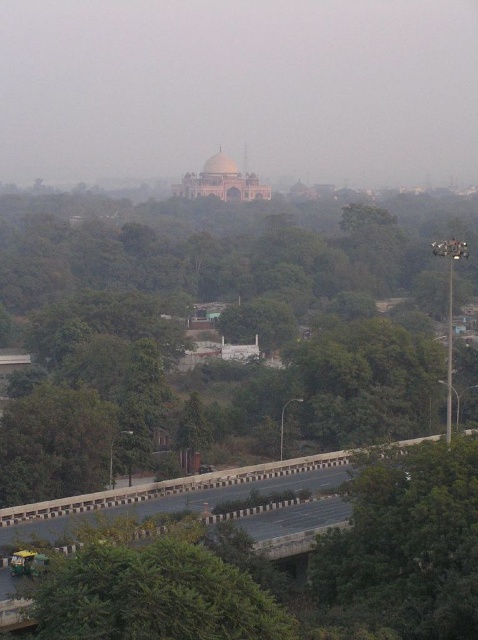
You are a photographer planning to capture the entire asphalt road at lower center and the green leafy tree at lower right in a single frame. Based on their sizes, which object will appear smaller in the photo?

The green leafy tree at lower right will appear smaller in the photo because its width is less than the asphalt road at lower center.

You are a pedestrian standing at the edge of the asphalt road at lower center. You want to reach the green leafy tree at lower right. According to the scene, is the tree above or below the road?

The green leafy tree at lower right is located above the asphalt road at lower center, so the tree is above the road.